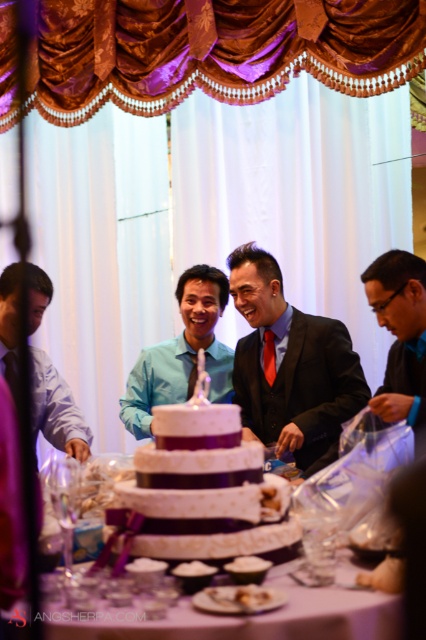
You are a photographer at the wedding reception. You need to capture a photo of the matte blue shirt at left and the red satin tie at center. Which one should you focus on first if you want to ensure both are in focus?

The matte blue shirt at left is taller than the red satin tie at center, so focusing on the matte blue shirt at left first will help ensure both are in focus since it requires a closer focus distance.

You are a photographer at the event and want to capture both the matte black suit at lower right and the matte blue shirt at left in a single photo. However, you can only adjust your position to include both subjects. Based on their positions, which subject should you focus on first to ensure both are in frame?

The matte blue shirt at left is behind the matte black suit at lower right. To include both in the frame, focus on positioning the matte black suit at lower right first, as the matte blue shirt at left is further back and may require adjusting the angle to ensure it is visible without being obstructed.

You are a photographer positioned at the center of the room. You need to capture a photo of the cake without the matte blue shirt at left appearing in the frame. Is the current position suitable for this?

The matte blue shirt at left is located at point [57,410], which is to the left side of the scene. Since you are positioned at the center, adjusting your angle slightly to the right should allow you to frame the cake without including the matte blue shirt at left in the shot.